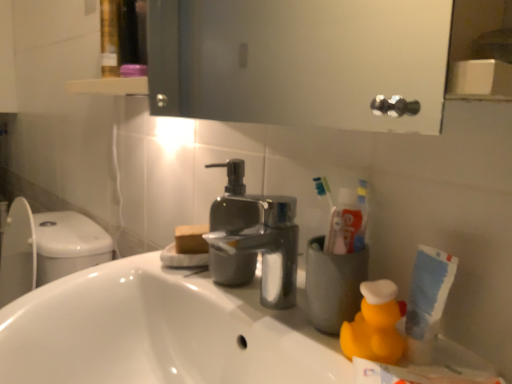
What do you see at coordinates (254, 239) in the screenshot? I see `polished metallic faucet at center` at bounding box center [254, 239].

Measure the distance between point (311, 345) and camera.

The distance of point (311, 345) from camera is 19.29 inches.

Locate an element on the screen. Image resolution: width=512 pixels, height=384 pixels. white glossy sink at lower left is located at coordinates (160, 332).

Locate an element on the screen. The height and width of the screenshot is (384, 512). polished metallic faucet at center is located at coordinates (254, 239).

Is polished metallic faucet at center positioned far away from white glossy sink at lower left?

No, polished metallic faucet at center is in close proximity to white glossy sink at lower left.

From the image's perspective, relative to white glossy sink at lower left, is polished metallic faucet at center above or below?

Based on their image positions, polished metallic faucet at center is located above white glossy sink at lower left.

Considering the sizes of objects polished metallic faucet at center and white glossy sink at lower left in the image provided, who is thinner, polished metallic faucet at center or white glossy sink at lower left?

polished metallic faucet at center.

In terms of size, does polished metallic faucet at center appear bigger or smaller than white glossy sink at lower left?

Clearly, polished metallic faucet at center is smaller in size than white glossy sink at lower left.

Does yellow rubber duck at lower right contain white glossy sink at lower left?

No, white glossy sink at lower left is not a part of yellow rubber duck at lower right.

Is yellow rubber duck at lower right oriented towards white glossy sink at lower left?

No, yellow rubber duck at lower right is not facing towards white glossy sink at lower left.

Is yellow rubber duck at lower right positioned behind white glossy sink at lower left?

Yes, yellow rubber duck at lower right is further from the viewer.

From the image's perspective, is yellow rubber duck at lower right located beneath white glossy sink at lower left?

Actually, yellow rubber duck at lower right appears above white glossy sink at lower left in the image.

Could you tell me if white glossy sink at lower left is turned towards polished metallic faucet at center?

No, white glossy sink at lower left is not turned towards polished metallic faucet at center.

Can you confirm if white glossy sink at lower left is shorter than polished metallic faucet at center?

No, white glossy sink at lower left is not shorter than polished metallic faucet at center.

From the image's perspective, which one is positioned higher, white glossy sink at lower left or polished metallic faucet at center?

From the image's view, polished metallic faucet at center is above.

Does polished metallic faucet at center lie in front of yellow rubber duck at lower right?

That is False.

Does point (276, 278) come farther from viewer compared to point (383, 362)?

Yes, point (276, 278) is behind point (383, 362).

Does polished metallic faucet at center turn towards yellow rubber duck at lower right?

No.

From the image's perspective, which is below, polished metallic faucet at center or yellow rubber duck at lower right?

From the image's view, yellow rubber duck at lower right is below.

Would you consider white glossy sink at lower left to be distant from yellow rubber duck at lower right?

That's not correct — white glossy sink at lower left is a little close to yellow rubber duck at lower right.

From a real-world perspective, which object stands above the other?

yellow rubber duck at lower right.

Who is smaller, white glossy sink at lower left or yellow rubber duck at lower right?

With smaller size is yellow rubber duck at lower right.

You are a GUI agent. You are given a task and a screenshot of the screen. Output one action in this format:
    pyautogui.click(x=<x>, y=<y>)
    Task: Click on the counter top on the left of yellow rubber duck at lower right
    
    Given the screenshot: What is the action you would take?
    pyautogui.click(x=160, y=332)

From the image's perspective, who appears lower, yellow rubber duck at lower right or polished metallic faucet at center?

yellow rubber duck at lower right.

Considering the relative sizes of yellow rubber duck at lower right and polished metallic faucet at center in the image provided, is yellow rubber duck at lower right smaller than polished metallic faucet at center?

Yes.

Considering the relative sizes of yellow rubber duck at lower right and polished metallic faucet at center in the image provided, is yellow rubber duck at lower right taller than polished metallic faucet at center?

No, yellow rubber duck at lower right is not taller than polished metallic faucet at center.

Is yellow rubber duck at lower right touching polished metallic faucet at center?

No, yellow rubber duck at lower right is not next to polished metallic faucet at center.

At what (x,y) coordinates should I click in order to perform the action: click on tap behind the white glossy sink at lower left. Please return your answer as a coordinate pair (x, y). Looking at the image, I should click on (254, 239).

The width and height of the screenshot is (512, 384). Identify the location of counter top that is below the yellow rubber duck at lower right (from the image's perspective). (160, 332).

Based on their spatial positions, is yellow rubber duck at lower right or white glossy sink at lower left further from polished metallic faucet at center?

yellow rubber duck at lower right lies further to polished metallic faucet at center than the other object.

Which object lies further to the anchor point yellow rubber duck at lower right, polished metallic faucet at center or white glossy sink at lower left?

white glossy sink at lower left is further to yellow rubber duck at lower right.

Which object lies nearer to the anchor point white glossy sink at lower left, polished metallic faucet at center or yellow rubber duck at lower right?

polished metallic faucet at center lies closer to white glossy sink at lower left than the other object.

Looking at the image, which one is located closer to yellow rubber duck at lower right, white glossy sink at lower left or polished metallic faucet at center?

polished metallic faucet at center.

When comparing their distances from white glossy sink at lower left, does yellow rubber duck at lower right or polished metallic faucet at center seem closer?

polished metallic faucet at center lies closer to white glossy sink at lower left than the other object.

Which object lies nearer to the anchor point polished metallic faucet at center, white glossy sink at lower left or yellow rubber duck at lower right?

white glossy sink at lower left is closer to polished metallic faucet at center.

This screenshot has height=384, width=512. Identify the location of cleaning product positioned between white glossy sink at lower left and polished metallic faucet at center from near to far. (375, 324).